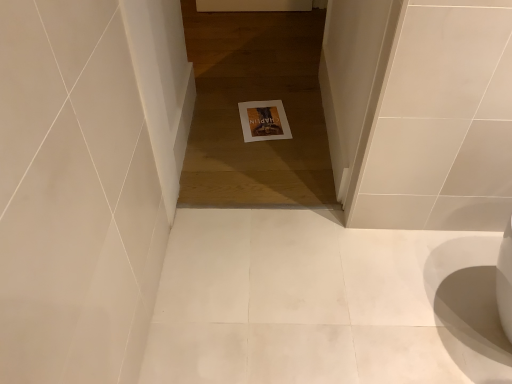
You are a GUI agent. You are given a task and a screenshot of the screen. Output one action in this format:
    pyautogui.click(x=<x>, y=<y>)
    Task: Click on the vacant space positioned to the left of white paper at center
    The image size is (512, 384).
    Given the screenshot: What is the action you would take?
    pyautogui.click(x=213, y=118)